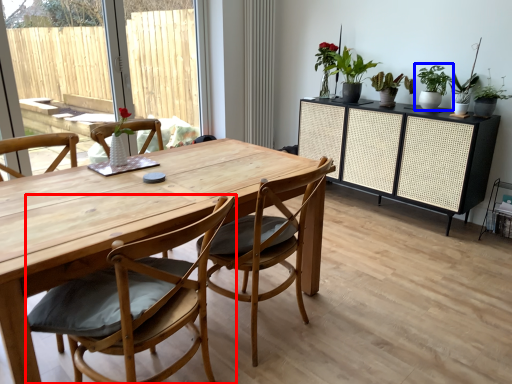
Question: Among these objects, which one is nearest to the camera, chair (highlighted by a red box) or houseplant (highlighted by a blue box)?

Choices:
 (A) chair
 (B) houseplant

Answer: (A)